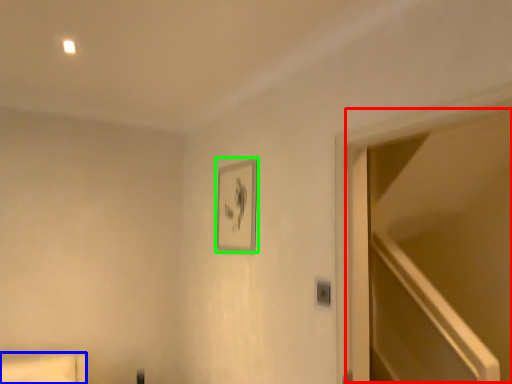
Question: Which is nearer to the glass door (highlighted by a red box)? furniture (highlighted by a blue box) or picture frame (highlighted by a green box).

Choices:
 (A) furniture
 (B) picture frame

Answer: (B)